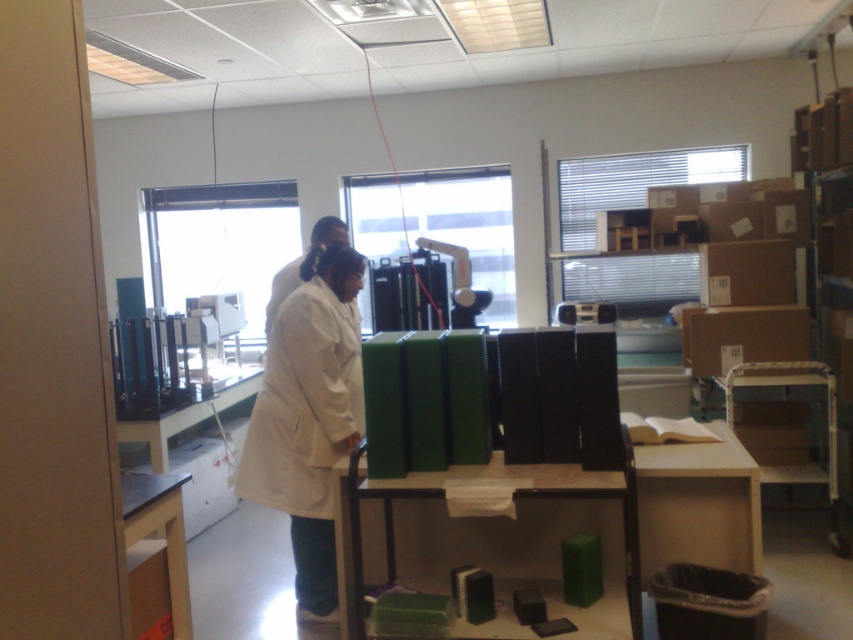
Looking at this image, which is below, white matte lab coat at center or white lab coat at center?

white matte lab coat at center is below.

Is point (248, 420) closer to viewer compared to point (332, 243)?

No.

The image size is (853, 640). Identify the location of white matte lab coat at center. 308,417.